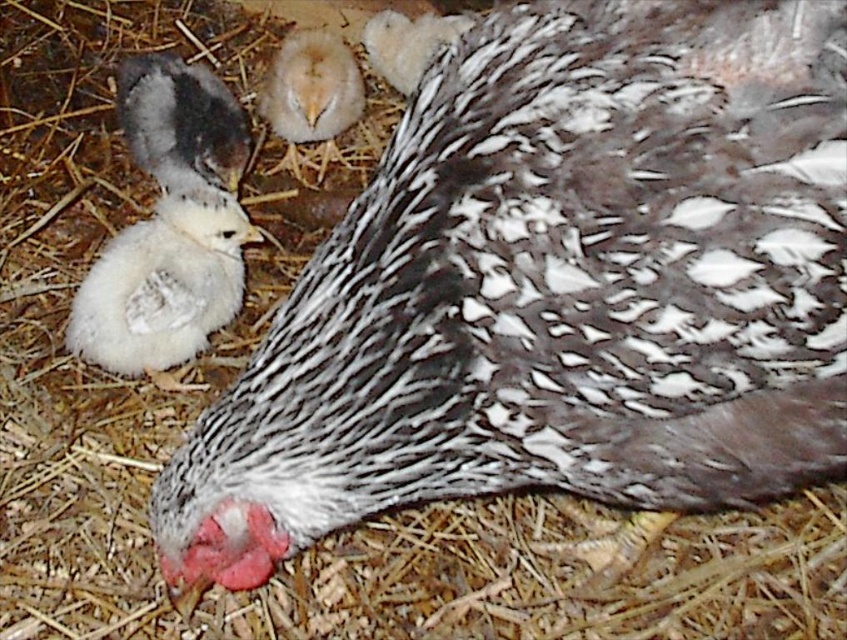
Looking at this image, based on the scene description, which object is taller, the white fluffy chick at left or the speckled feathered chicken at center?

The white fluffy chick at left is much taller than the speckled feathered chicken at center according to the description.

You are a photographer taking a picture of the mother chicken and her chicks. You want to focus on the light yellow down at center. Where should you aim your camera to capture it?

You should aim your camera at point (311, 88) to capture the light yellow down at center.